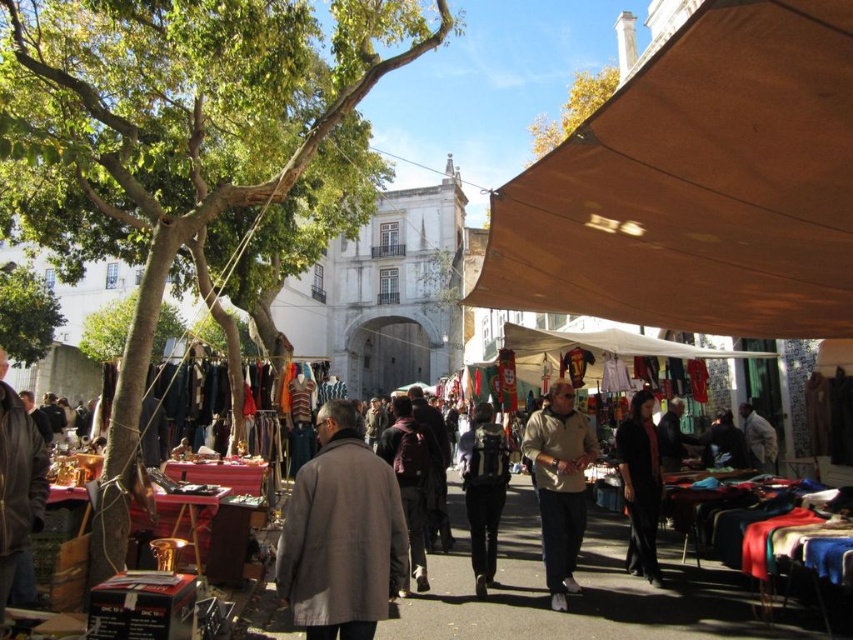
Between matte brown table at center and dark gray backpack at center, which one is positioned higher?

matte brown table at center is above.

Does matte brown table at center have a smaller size compared to dark gray backpack at center?

No, matte brown table at center is not smaller than dark gray backpack at center.

I want to click on matte brown table at center, so click(x=589, y=593).

Between dark gray backpack at center and dark brown backpack at center, which one appears on the right side from the viewer's perspective?

dark gray backpack at center

Measure the distance between point (471, 545) and camera.

Point (471, 545) is 213.43 feet from camera.

This screenshot has width=853, height=640. In order to click on dark gray backpack at center in this screenshot , I will do `click(483, 490)`.

Is point (567, 388) closer to viewer compared to point (642, 474)?

No.

Measure the distance between point (x=577, y=516) and camera.

Point (x=577, y=516) and camera are 63.16 meters apart from each other.

Where is `light brown fabric jacket at center`? This screenshot has height=640, width=853. light brown fabric jacket at center is located at coordinates (560, 484).